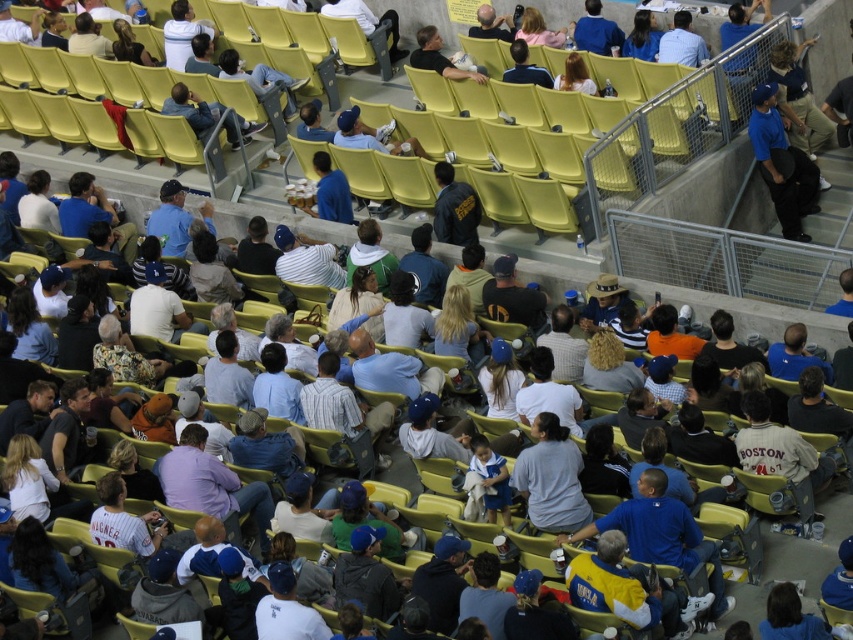
Is point (241, 120) in front of point (433, 45)?

Yes, it is.

Which is in front, point (250, 125) or point (421, 65)?

Point (250, 125) is in front.

The width and height of the screenshot is (853, 640). In order to click on blue denim jeans at center in this screenshot , I will do `click(192, 109)`.

You are a GUI agent. You are given a task and a screenshot of the screen. Output one action in this format:
    pyautogui.click(x=<x>, y=<y>)
    Task: Click on the blue denim jeans at center
    The image size is (853, 640).
    Given the screenshot: What is the action you would take?
    pyautogui.click(x=192, y=109)

Does light gray shirt at center lie behind blue matte baseball cap at upper right?

No, it is not.

Does light gray shirt at center appear under blue matte baseball cap at upper right?

Yes, light gray shirt at center is below blue matte baseball cap at upper right.

Describe the element at coordinates (550, 477) in the screenshot. The image size is (853, 640). I see `light gray shirt at center` at that location.

The height and width of the screenshot is (640, 853). I want to click on light gray shirt at center, so click(550, 477).

Can you confirm if blue denim jeans at center is taller than matte blue shirt at center?

Correct, blue denim jeans at center is much taller as matte blue shirt at center.

Can you confirm if blue denim jeans at center is smaller than matte blue shirt at center?

Incorrect, blue denim jeans at center is not smaller in size than matte blue shirt at center.

Does point (178, 97) lie behind point (519, 49)?

Yes, point (178, 97) is farther from viewer.

Locate an element on the screen. The height and width of the screenshot is (640, 853). blue denim jeans at center is located at coordinates (192, 109).